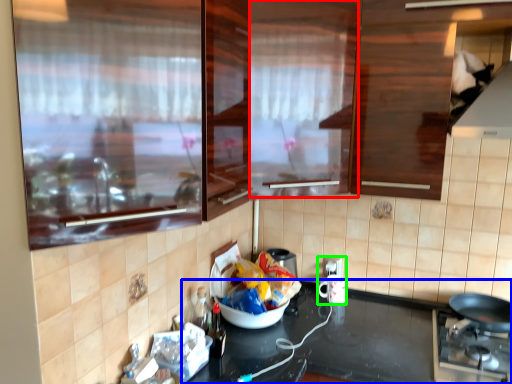
Question: Which object is positioned farthest from glass door (highlighted by a red box)? Select from countertop (highlighted by a blue box) and appliance (highlighted by a green box).

Choices:
 (A) countertop
 (B) appliance

Answer: (B)